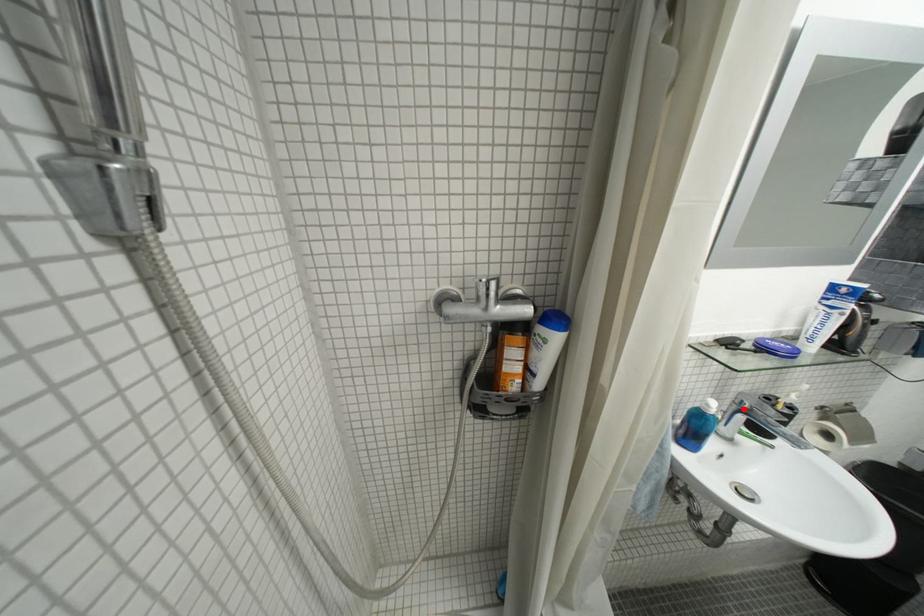
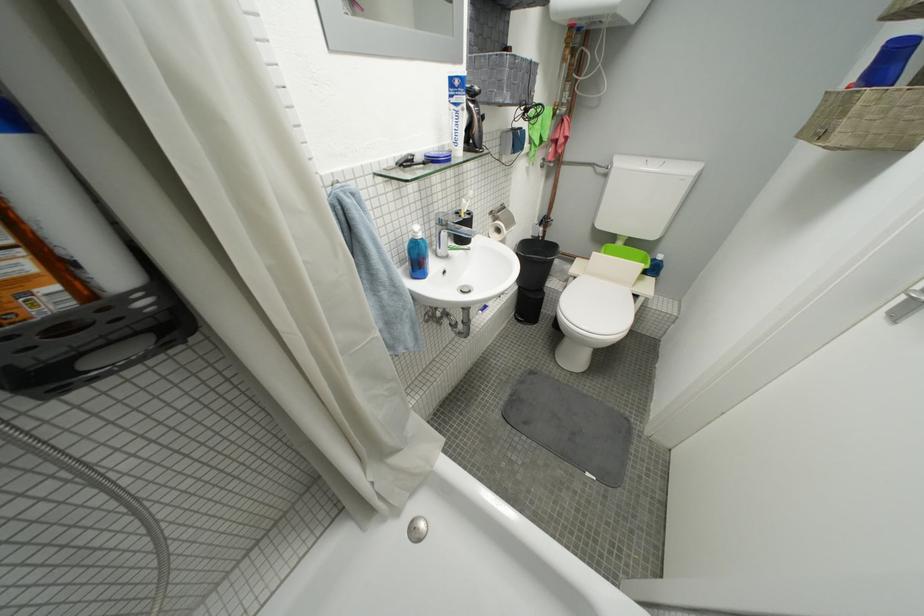
Question: I am providing you with two images of the same scene from different viewpoints. Given a red point in image1, look at the same physical point in image2. Is it:

Choices:
 (A) Closer to the viewpoint
 (B) Farther from the viewpoint

Answer: (A)